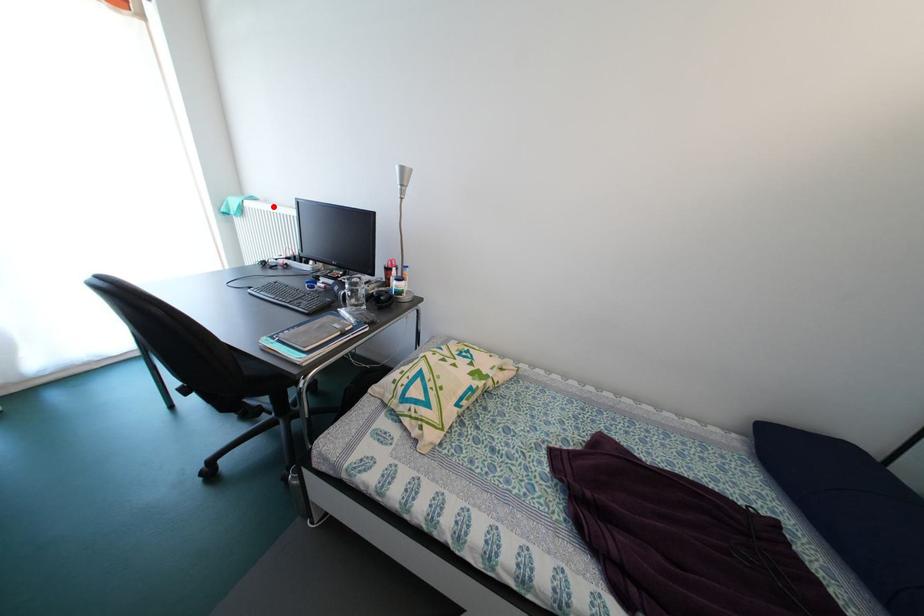
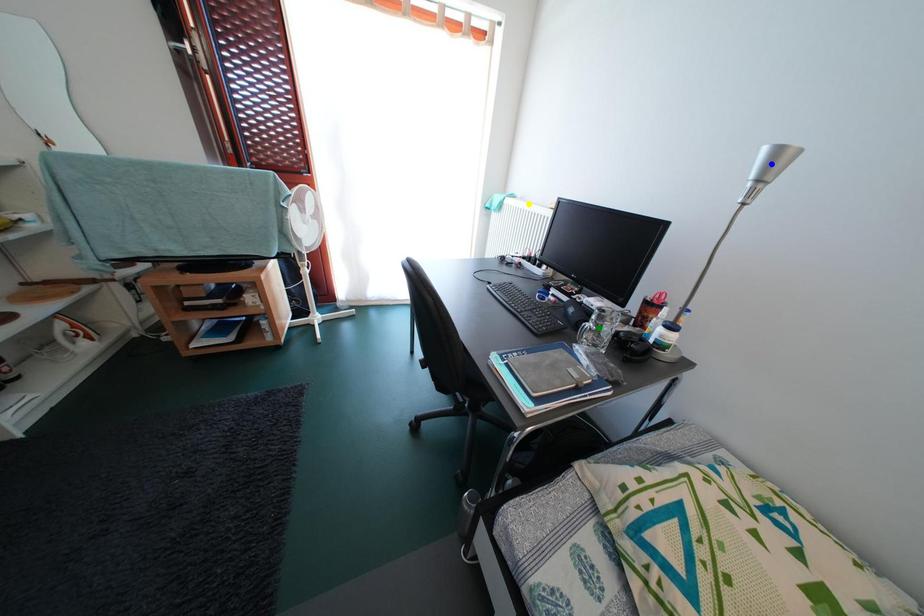
Question: I am providing you with two images of the same scene from different viewpoints. A red point is marked on the first image. You are given multiple points on the second image. Which point in image 2 is actually the same real-world point as the red point in image 1?

Choices:
 (A) yellow point
 (B) blue point
 (C) green point

Answer: (A)